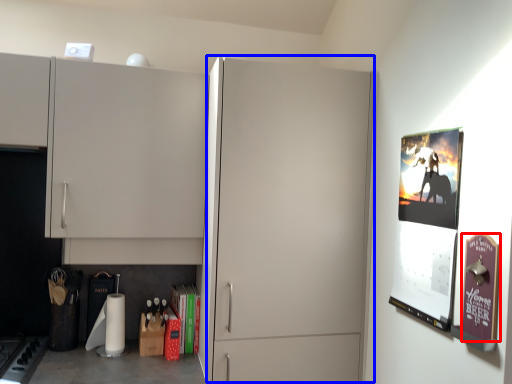
Question: Which of the following is the farthest to the observer, poster page (highlighted by a red box) or glass door (highlighted by a blue box)?

Choices:
 (A) poster page
 (B) glass door

Answer: (B)